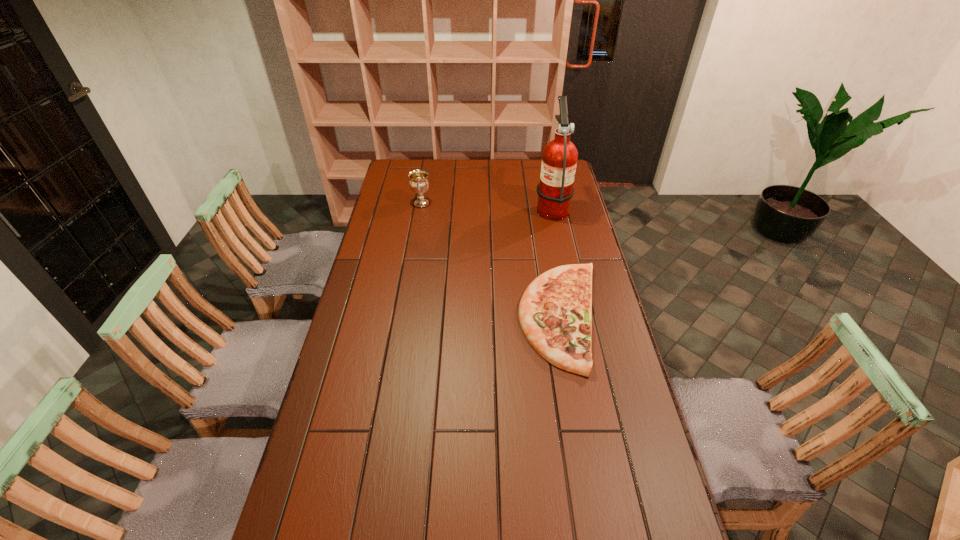
At what (x,y) coordinates should I click in order to perform the action: click on object that is positioned at the left edge. Please return your answer as a coordinate pair (x, y). Image resolution: width=960 pixels, height=540 pixels. Looking at the image, I should click on [x=419, y=183].

At what (x,y) coordinates should I click in order to perform the action: click on fire extinguisher at the right edge. Please return your answer as a coordinate pair (x, y). Looking at the image, I should click on (555, 190).

Locate an element on the screen. pizza that is at the right edge is located at coordinates point(555,312).

Where is `vacant area at the far edge`? The image size is (960, 540). vacant area at the far edge is located at coordinates (517, 166).

You are a GUI agent. You are given a task and a screenshot of the screen. Output one action in this format:
    pyautogui.click(x=<x>, y=<y>)
    Task: Click on the free space at the left edge of the desktop
    Image resolution: width=960 pixels, height=540 pixels.
    Given the screenshot: What is the action you would take?
    pyautogui.click(x=352, y=339)

Locate an element on the screen. The image size is (960, 540). free space at the right edge of the desktop is located at coordinates (646, 473).

Identify the location of vacant area that lies between the fire extinguisher and the second tallest object. (487, 205).

You are a GUI agent. You are given a task and a screenshot of the screen. Output one action in this format:
    pyautogui.click(x=<x>, y=<y>)
    Task: Click on the free spot between the shortest object and the second tallest object
    
    Given the screenshot: What is the action you would take?
    pyautogui.click(x=492, y=260)

At what (x,y) coordinates should I click in order to perform the action: click on free space between the pizza and the leftmost object. Please return your answer as a coordinate pair (x, y). The height and width of the screenshot is (540, 960). Looking at the image, I should click on (492, 260).

You are a GUI agent. You are given a task and a screenshot of the screen. Output one action in this format:
    pyautogui.click(x=<x>, y=<y>)
    Task: Click on the vacant space that's between the chalice and the nearest object
    Image resolution: width=960 pixels, height=540 pixels.
    Given the screenshot: What is the action you would take?
    (492, 260)